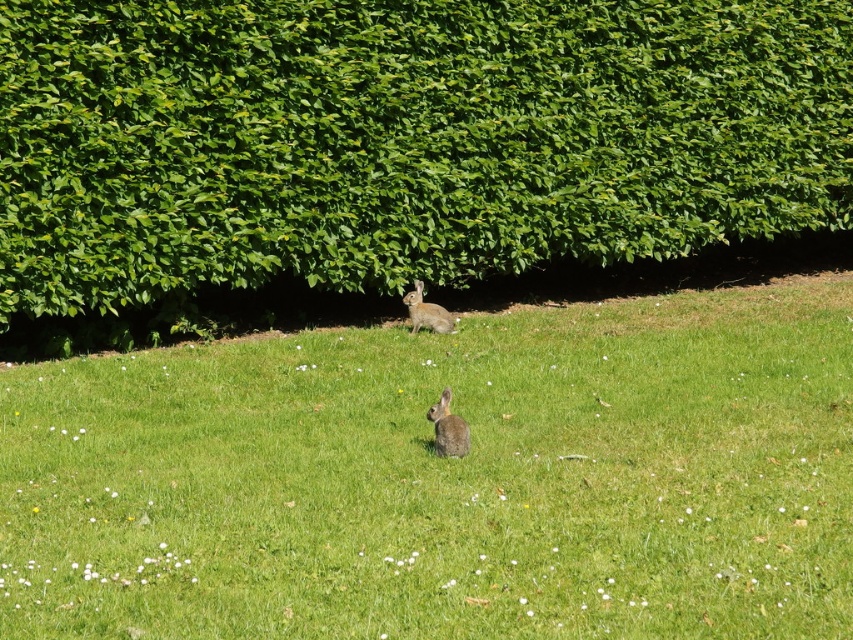
Question: Among these objects, which one is farthest from the camera?

Choices:
 (A) green leafy hedge at center
 (B) fuzzy brown rabbit at center
 (C) green grassy at center

Answer: (A)

Question: Can you confirm if green leafy hedge at center is bigger than fuzzy brown rabbit at center?

Choices:
 (A) no
 (B) yes

Answer: (B)

Question: Does green grassy at center have a greater width compared to fuzzy brown rabbit at center?

Choices:
 (A) no
 (B) yes

Answer: (B)

Question: Among these points, which one is nearest to the camera?

Choices:
 (A) tap(78, 634)
 (B) tap(409, 307)
 (C) tap(485, 38)

Answer: (A)

Question: Does green grassy at center lie in front of furry brown rabbit at center?

Choices:
 (A) no
 (B) yes

Answer: (B)

Question: Considering the real-world distances, which object is closest to the green grassy at center?

Choices:
 (A) furry brown rabbit at center
 (B) fuzzy brown rabbit at center

Answer: (A)